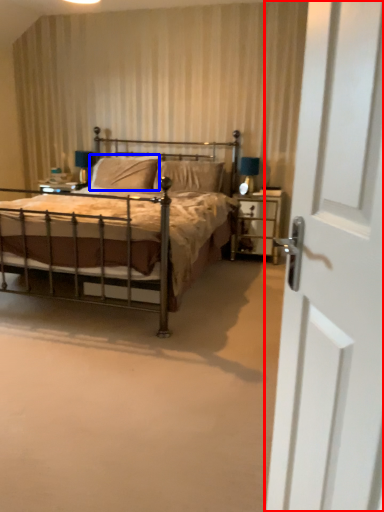
Question: Which object is closer to the camera taking this photo, door (highlighted by a red box) or pillow (highlighted by a blue box)?

Choices:
 (A) door
 (B) pillow

Answer: (A)